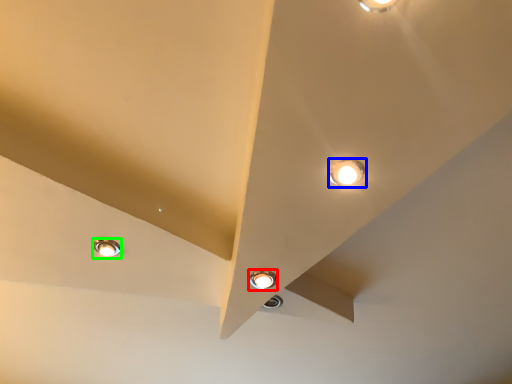
Question: Based on their relative distances, which object is farther from lamp (highlighted by a red box)? Choose from lamp (highlighted by a blue box) and lamp (highlighted by a green box).

Choices:
 (A) lamp
 (B) lamp

Answer: (B)